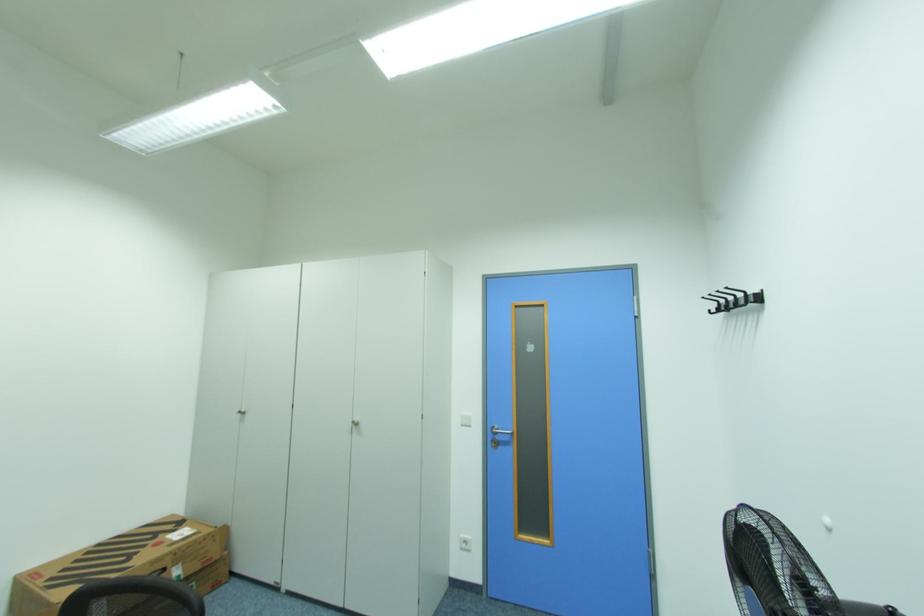
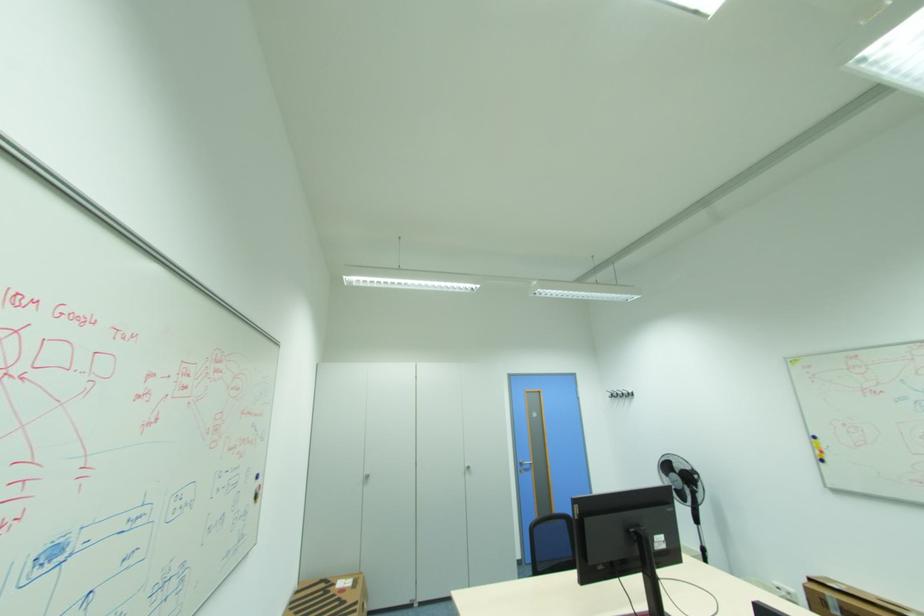
In the second image, find the point that corresponds to [504,438] in the first image.

(529, 467)